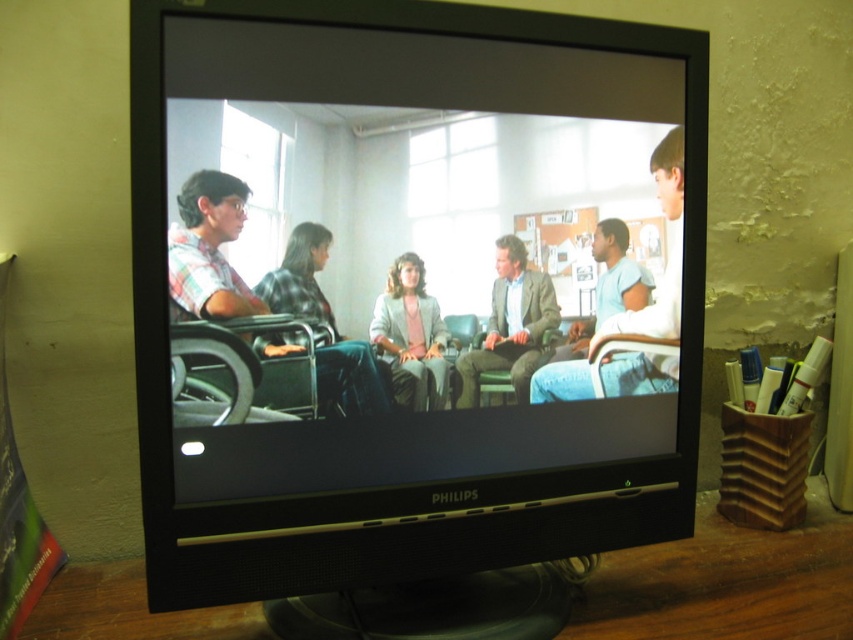
Question: Which of the following is the closest to the observer?

Choices:
 (A) metallic gray wheelchair at center
 (B) green textured suit at center
 (C) plaid shirt at center

Answer: (A)

Question: Is metallic gray wheelchair at center closer to the viewer compared to plaid shirt at center?

Choices:
 (A) no
 (B) yes

Answer: (B)

Question: Which point is closer to the camera taking this photo?

Choices:
 (A) (412, 282)
 (B) (663, 205)
 (C) (537, 349)
 (D) (236, 282)

Answer: (D)

Question: Where is metallic gray wheelchair at center located in relation to plaid shirt at center in the image?

Choices:
 (A) below
 (B) above

Answer: (B)

Question: Is black plastic monitor at center to the left of plaid shirt at center from the viewer's perspective?

Choices:
 (A) no
 (B) yes

Answer: (A)

Question: Estimate the real-world distances between objects in this image. Which object is closer to the black plastic monitor at center?

Choices:
 (A) light blue fabric shirt at right
 (B) green textured suit at center
 (C) metallic gray wheelchair at center

Answer: (C)